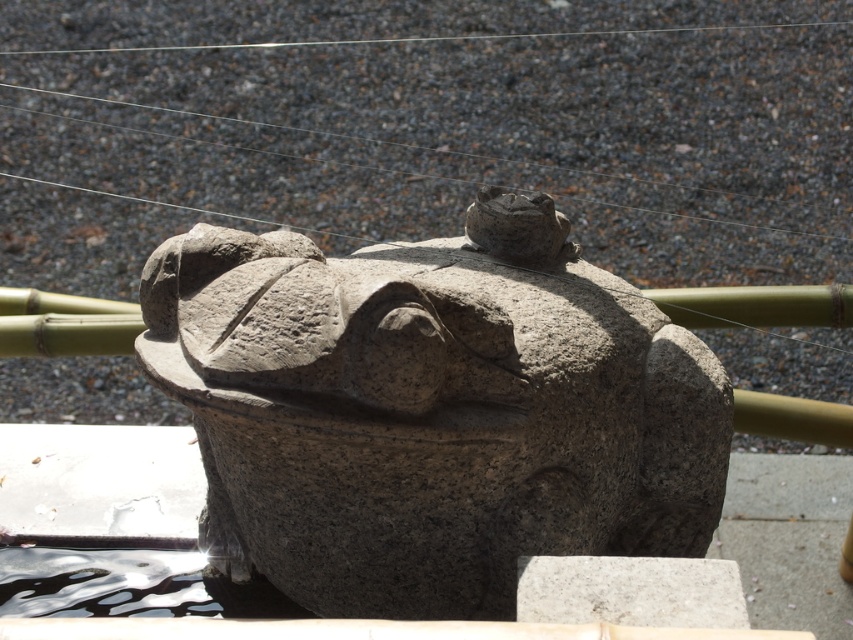
You are a gardener who wants to place a new potted plant between the granite statue at center and the gray granite stone at center. Since both objects are at the center, how can you determine where to place the potted plant?

The granite statue at center is above the gray granite stone at center, so you should place the potted plant between them by positioning it on the ground level near the gray granite stone at center, as the statue is elevated.

You are a landscape architect designing a garden path. You have a granite statue at center and a gray granite stone at center. Which object should you avoid placing a bench next to if you want to ensure there is enough space for people to walk comfortably?

The granite statue at center might be wider than the gray granite stone at center, so placing a bench next to the granite statue at center could leave less space for pedestrians, making it less ideal for a bench placement.